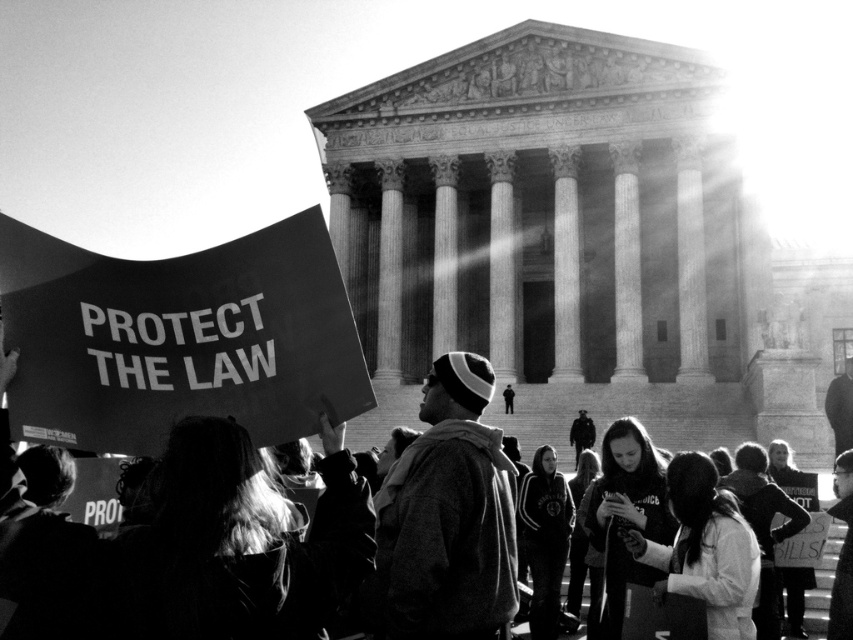
Question: Can you confirm if knit cap at center is wider than black cardboard sign at lower left?

Choices:
 (A) no
 (B) yes

Answer: (A)

Question: Is knit cap at center thinner than black cardboard sign at lower left?

Choices:
 (A) no
 (B) yes

Answer: (B)

Question: Which object appears farthest from the camera in this image?

Choices:
 (A) black cardboard sign at lower left
 (B) knit cap at center

Answer: (B)

Question: Is the position of knit cap at center more distant than that of black cardboard sign at lower left?

Choices:
 (A) no
 (B) yes

Answer: (B)

Question: Which point is farther from the camera taking this photo?

Choices:
 (A) (460, 400)
 (B) (639, 390)

Answer: (B)